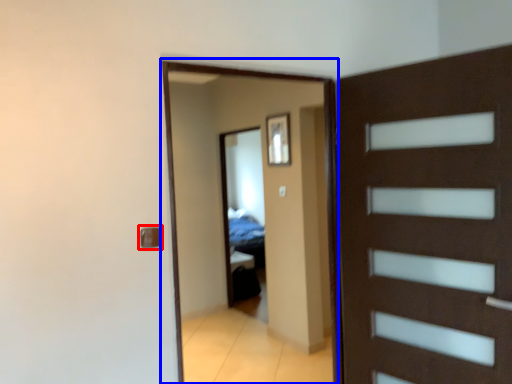
Question: Which point is further to the camera, door handle (highlighted by a red box) or screen door (highlighted by a blue box)?

Choices:
 (A) door handle
 (B) screen door

Answer: (B)